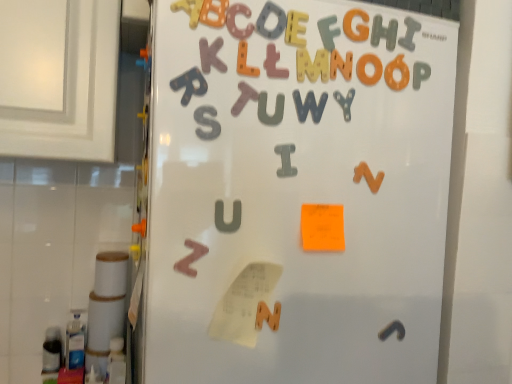
Question: From a real-world perspective, is gray matte letter i at upper center, the 9th letter in the left-to-right sequence, physically below orange matte letter g at upper center, arranged as the 2th letter when viewed from the right?

Choices:
 (A) yes
 (B) no

Answer: (B)

Question: Is gray matte letter i at upper center, the 1th letter positioned from the right, directly adjacent to orange matte letter g at upper center, arranged as the 2th letter when viewed from the right?

Choices:
 (A) yes
 (B) no

Answer: (A)

Question: Is gray matte letter i at upper center, the 1th letter positioned from the right, aimed at orange matte letter g at upper center, the 8th letter from the left?

Choices:
 (A) no
 (B) yes

Answer: (A)

Question: From a real-world perspective, does gray matte letter i at upper center, the 9th letter in the left-to-right sequence, stand above orange matte letter g at upper center, arranged as the 2th letter when viewed from the right?

Choices:
 (A) yes
 (B) no

Answer: (A)

Question: From the image's perspective, is gray matte letter i at upper center, the 9th letter in the left-to-right sequence, over orange matte letter g at upper center, arranged as the 2th letter when viewed from the right?

Choices:
 (A) yes
 (B) no

Answer: (A)

Question: Is gray matte letter i at upper center, the 9th letter in the left-to-right sequence, completely or partially outside of orange matte letter g at upper center, arranged as the 2th letter when viewed from the right?

Choices:
 (A) no
 (B) yes

Answer: (B)

Question: Are gray matte letter u at center, which is the 4th letter from left to right, and metallic silver letter y at upper center, which is counted as the 4th alphabet, starting from the front, far apart?

Choices:
 (A) yes
 (B) no

Answer: (B)

Question: From a real-world perspective, is gray matte letter u at center, marked as the sixth letter in a right-to-left arrangement, positioned under metallic silver letter y at upper center, acting as the fourth alphabet starting from the left, based on gravity?

Choices:
 (A) yes
 (B) no

Answer: (A)

Question: From the image's perspective, is gray matte letter u at center, which is the 4th letter from left to right, beneath metallic silver letter y at upper center, which appears as the 2th alphabet when viewed from the right?

Choices:
 (A) yes
 (B) no

Answer: (A)

Question: Considering the relative sizes of gray matte letter u at center, marked as the sixth letter in a right-to-left arrangement, and metallic silver letter y at upper center, which appears as the 2th alphabet when viewed from the right, in the image provided, is gray matte letter u at center, marked as the sixth letter in a right-to-left arrangement, wider than metallic silver letter y at upper center, which appears as the 2th alphabet when viewed from the right,?

Choices:
 (A) no
 (B) yes

Answer: (A)

Question: Is gray matte letter u at center, marked as the sixth letter in a right-to-left arrangement, turned away from metallic silver letter y at upper center, acting as the fourth alphabet starting from the left?

Choices:
 (A) no
 (B) yes

Answer: (A)

Question: Is gray matte letter u at center, which is the 4th letter from left to right, positioned beyond the bounds of metallic silver letter y at upper center, which is the second alphabet from back to front?

Choices:
 (A) yes
 (B) no

Answer: (A)

Question: Is orange matte letter g at upper center, the 8th letter from the left, oriented towards matte pink letter at center, the 5th letter positioned from the left?

Choices:
 (A) no
 (B) yes

Answer: (A)